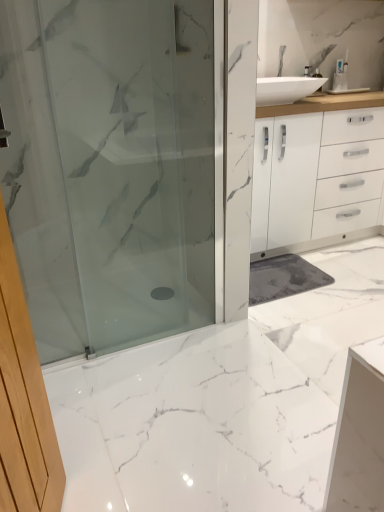
Locate an element on the screen. This screenshot has width=384, height=512. white plastic toothbrush at upper right is located at coordinates (339, 66).

The width and height of the screenshot is (384, 512). I want to click on white marble floor at center, so click(x=193, y=426).

This screenshot has width=384, height=512. I want to click on satin glass shower door at center, so click(x=109, y=167).

From the image's perspective, which is above, white plastic toothbrush at upper right or white marble floor at center?

white plastic toothbrush at upper right appears higher in the image.

How different are the orientations of white plastic toothbrush at upper right and white marble floor at center in degrees?

white plastic toothbrush at upper right and white marble floor at center are facing 0.506 degrees away from each other.

Does white plastic toothbrush at upper right have a lesser height compared to white marble floor at center?

No.

The height and width of the screenshot is (512, 384). I want to click on toiletry lying on the right of white marble floor at center, so [x=339, y=66].

Can you confirm if satin glass shower door at center is positioned to the right of white marble floor at center?

Incorrect, satin glass shower door at center is not on the right side of white marble floor at center.

Considering the relative sizes of satin glass shower door at center and white marble floor at center in the image provided, is satin glass shower door at center wider than white marble floor at center?

In fact, satin glass shower door at center might be narrower than white marble floor at center.

Is point (154, 109) closer or farther from the camera than point (246, 500)?

Point (154, 109) is positioned farther from the camera compared to point (246, 500).

This screenshot has height=512, width=384. What are the coordinates of `marble located on the right of satin glass shower door at center` in the screenshot? It's located at (193, 426).

Is white marble floor at center completely or partially outside of satin glass shower door at center?

Absolutely, white marble floor at center is external to satin glass shower door at center.

Between white marble floor at center and satin glass shower door at center, which one appears on the right side from the viewer's perspective?

white marble floor at center is more to the right.

Locate an element on the screen. marble that is in front of the satin glass shower door at center is located at coordinates (193, 426).

Would you consider white marble floor at center to be distant from satin glass shower door at center?

No, white marble floor at center is not far away from satin glass shower door at center.

Is white plastic toothbrush at upper right inside the boundaries of satin glass shower door at center, or outside?

white plastic toothbrush at upper right lies outside satin glass shower door at center.

How much distance is there between white plastic toothbrush at upper right and satin glass shower door at center?

white plastic toothbrush at upper right is 4.75 feet away from satin glass shower door at center.

From a real-world perspective, which object stands above the other?

white plastic toothbrush at upper right.

Looking at this image, considering the sizes of white plastic toothbrush at upper right and satin glass shower door at center in the image, is white plastic toothbrush at upper right taller or shorter than satin glass shower door at center?

Clearly, white plastic toothbrush at upper right is shorter compared to satin glass shower door at center.

In the scene shown: Which object is positioned more to the right, satin glass shower door at center or white plastic toothbrush at upper right?

Positioned to the right is white plastic toothbrush at upper right.

From the picture: Would you say satin glass shower door at center is a long distance from white plastic toothbrush at upper right?

Yes, satin glass shower door at center and white plastic toothbrush at upper right are located far from each other.

Based on the photo, how far apart are satin glass shower door at center and white plastic toothbrush at upper right?

1.45 meters.

Looking at their sizes, would you say satin glass shower door at center is wider or thinner than white plastic toothbrush at upper right?

Considering their sizes, satin glass shower door at center looks broader than white plastic toothbrush at upper right.

Visually, is white marble floor at center positioned to the left or to the right of white plastic toothbrush at upper right?

In the image, white marble floor at center appears on the left side of white plastic toothbrush at upper right.

In order to click on toiletry above the white marble floor at center (from a real-world perspective) in this screenshot , I will do `click(339, 66)`.

Is the position of white marble floor at center less distant than that of white plastic toothbrush at upper right?

Yes, white marble floor at center is closer to the camera.

How different are the orientations of white marble floor at center and white plastic toothbrush at upper right in degrees?

They differ by 0.506 degrees in their facing directions.

The width and height of the screenshot is (384, 512). Find the location of `toiletry above the white marble floor at center (from a real-world perspective)`. toiletry above the white marble floor at center (from a real-world perspective) is located at coordinates (339, 66).

At what (x,y) coordinates should I click in order to perform the action: click on shower door behind the white marble floor at center. Please return your answer as a coordinate pair (x, y). Looking at the image, I should click on (109, 167).

Considering their positions, is white marble floor at center positioned further to white plastic toothbrush at upper right than satin glass shower door at center?

white marble floor at center is positioned further to the anchor white plastic toothbrush at upper right.

Which object lies nearer to the anchor point satin glass shower door at center, white plastic toothbrush at upper right or white marble floor at center?

white marble floor at center is closer to satin glass shower door at center.

From the image, which object appears to be farther from white marble floor at center, satin glass shower door at center or white plastic toothbrush at upper right?

white plastic toothbrush at upper right.

Which object lies nearer to the anchor point white marble floor at center, white plastic toothbrush at upper right or satin glass shower door at center?

Among the two, satin glass shower door at center is located nearer to white marble floor at center.

Which object lies further to the anchor point satin glass shower door at center, white marble floor at center or white plastic toothbrush at upper right?

Among the two, white plastic toothbrush at upper right is located further to satin glass shower door at center.

From the picture: Based on their spatial positions, is satin glass shower door at center or white marble floor at center closer to white plastic toothbrush at upper right?

The object closer to white plastic toothbrush at upper right is satin glass shower door at center.

At what (x,y) coordinates should I click in order to perform the action: click on shower door between white marble floor at center and white plastic toothbrush at upper right along the z-axis. Please return your answer as a coordinate pair (x, y). Looking at the image, I should click on (109, 167).